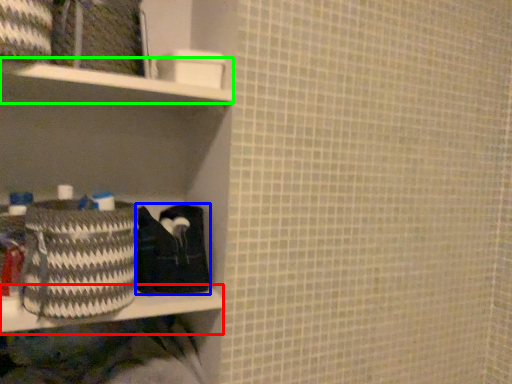
Question: Which object is positioned farthest from ledge (highlighted by a red box)? Select from material (highlighted by a blue box) and cabinet (highlighted by a green box).

Choices:
 (A) material
 (B) cabinet

Answer: (B)